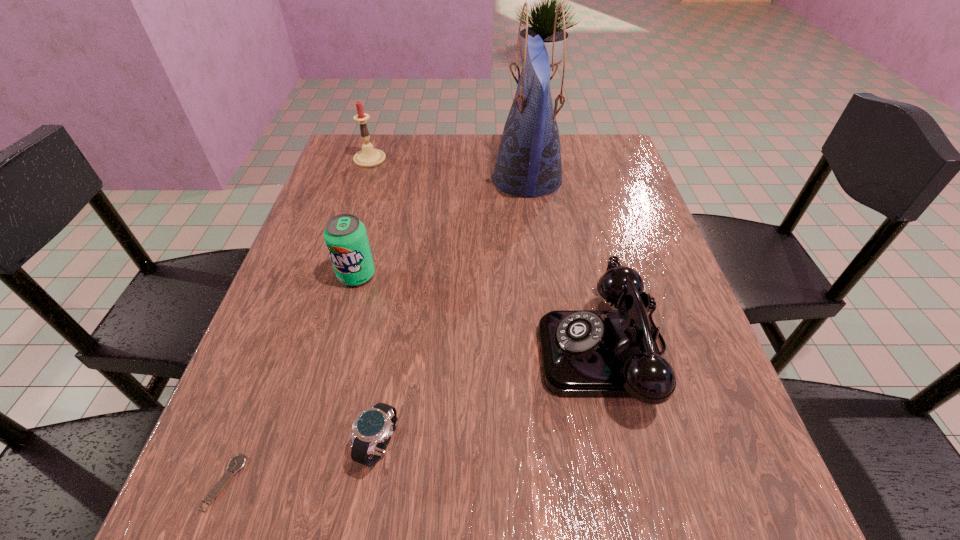
Locate an element on the screen. Image resolution: width=960 pixels, height=540 pixels. pop soda present at the left edge is located at coordinates (345, 235).

Where is `watch that is at the left edge`? watch that is at the left edge is located at coordinates (238, 462).

Where is `object at the right edge`? This screenshot has height=540, width=960. object at the right edge is located at coordinates (584, 353).

Locate an element on the screen. This screenshot has width=960, height=540. object situated at the far left corner is located at coordinates (368, 157).

The image size is (960, 540). Identify the location of object present at the near left corner. (238, 462).

Where is `vacant area at the far edge of the desktop`? This screenshot has height=540, width=960. vacant area at the far edge of the desktop is located at coordinates click(x=443, y=146).

The image size is (960, 540). In the image, there is a desktop. Find the location of `vacant region at the near edge`. vacant region at the near edge is located at coordinates pyautogui.click(x=511, y=508).

Locate an element on the screen. vacant region at the left edge of the desktop is located at coordinates (273, 315).

Locate an element on the screen. Image resolution: width=960 pixels, height=540 pixels. free space at the right edge of the desktop is located at coordinates (591, 234).

Identify the location of vacant space at the far left corner. (385, 137).